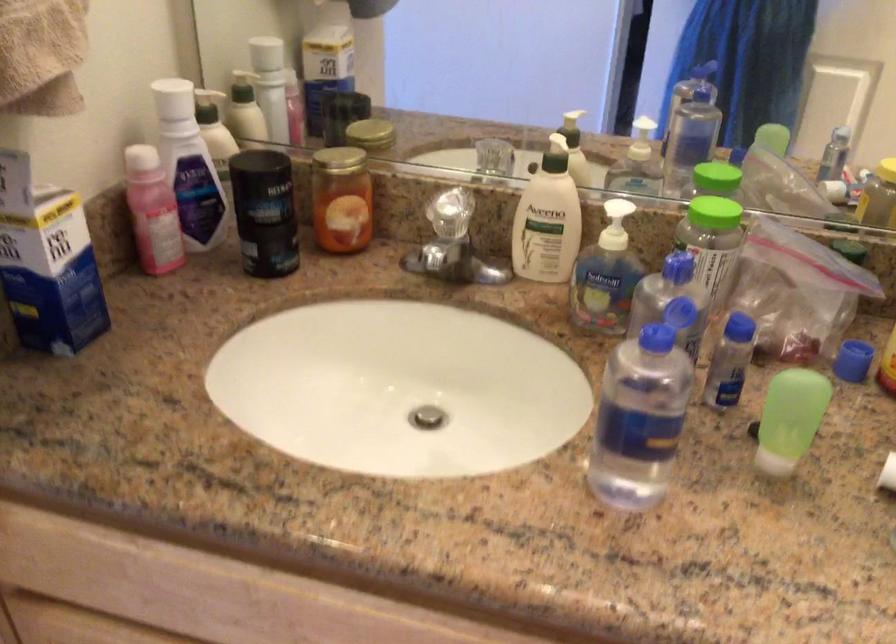
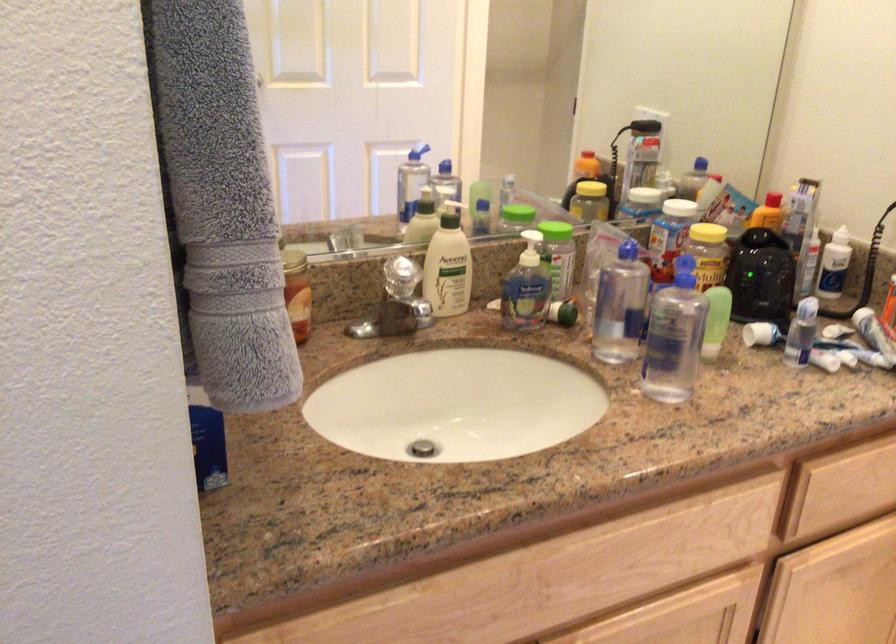
In the second image, find the point that corresponds to (531,219) in the first image.

(448, 265)